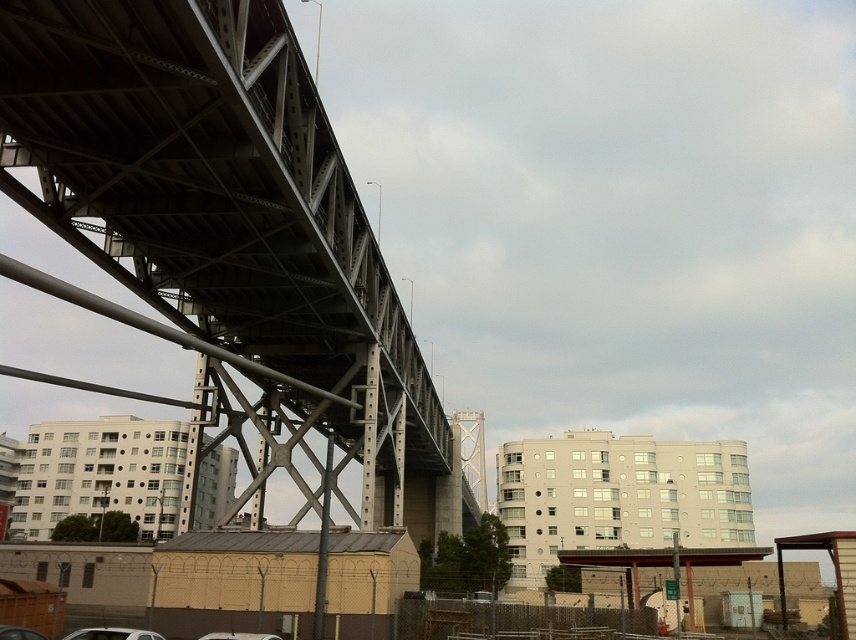
Is metallic gray bridge at upper left to the left of white matte car at lower left from the viewer's perspective?

Correct, you'll find metallic gray bridge at upper left to the left of white matte car at lower left.

Who is more distant from viewer, (x=214, y=374) or (x=129, y=637)?

The point (x=214, y=374) is behind.

The height and width of the screenshot is (640, 856). I want to click on metallic gray bridge at upper left, so click(x=229, y=237).